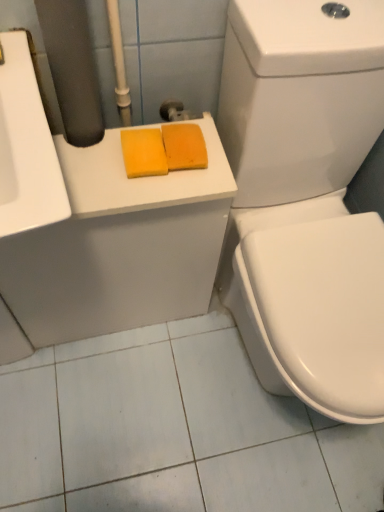
Locate an element on the screen. The width and height of the screenshot is (384, 512). vacant area situated to the left side of yellow sponge at center, which is the first soap in left-to-right order is located at coordinates (92, 155).